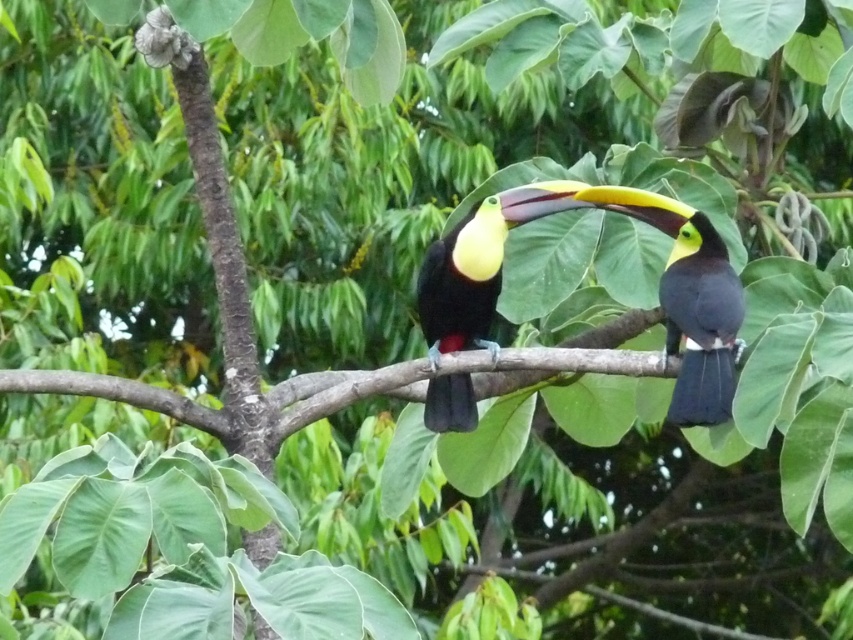
Can you confirm if shiny black toucan at center is positioned to the left of yellow glossy toucan at center?

Incorrect, shiny black toucan at center is not on the left side of yellow glossy toucan at center.

Locate an element on the screen. This screenshot has height=640, width=853. shiny black toucan at center is located at coordinates click(x=671, y=289).

Locate an element on the screen. The image size is (853, 640). shiny black toucan at center is located at coordinates (671, 289).